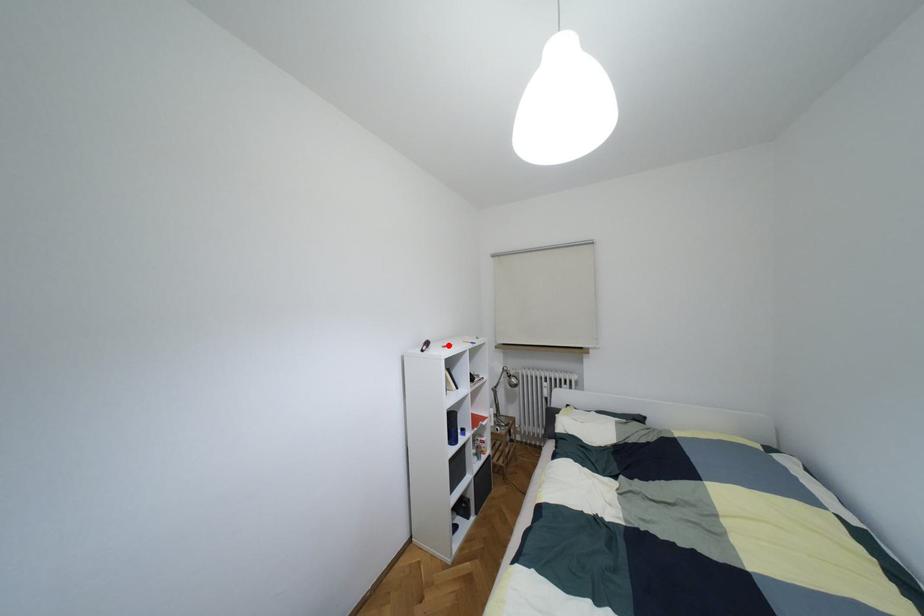
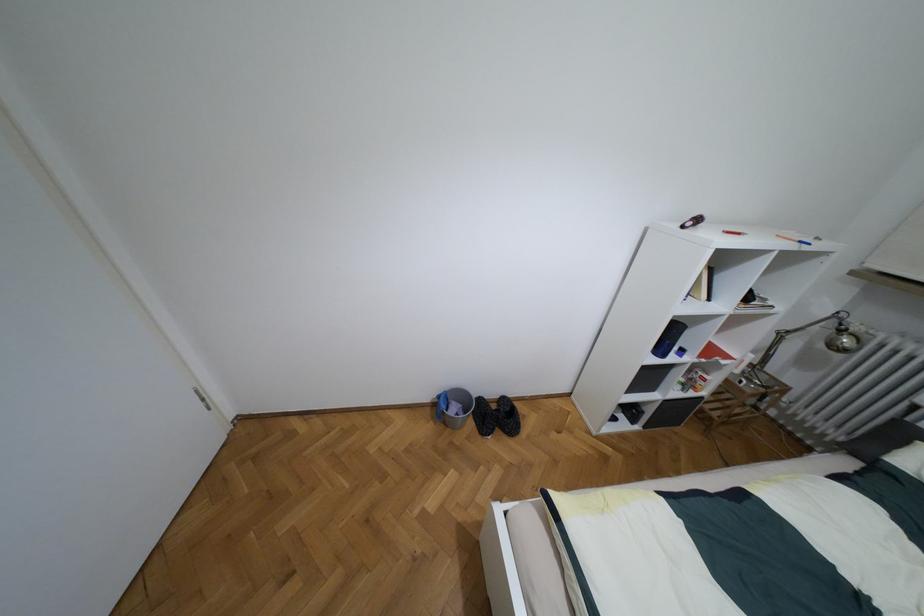
Where in the second image is the point corresponding to the highlighted location from the first image?

(737, 233)